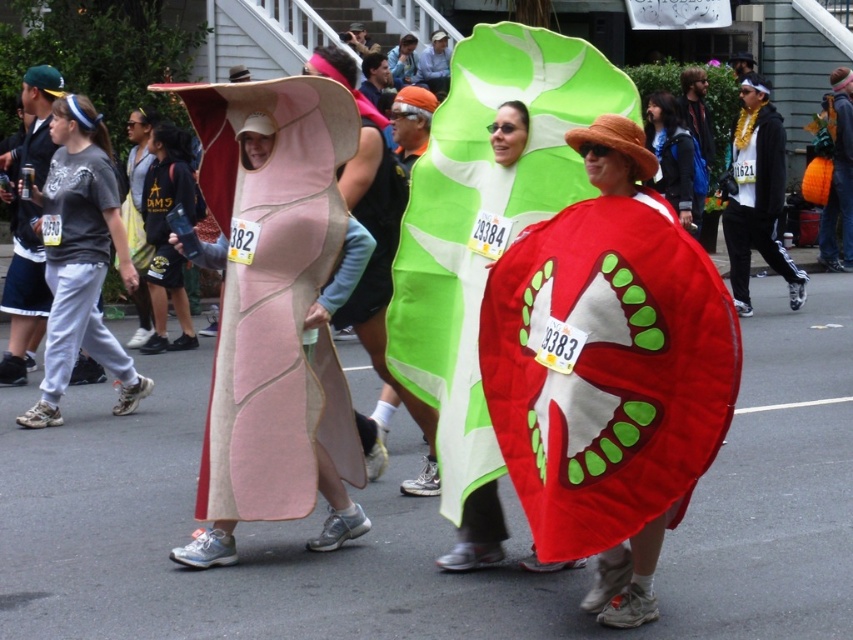
Question: Is velvet red heart at center positioned at the back of gray cotton t-shirt at left?

Choices:
 (A) no
 (B) yes

Answer: (A)

Question: Which point appears farthest from the camera in this image?

Choices:
 (A) (566, 561)
 (B) (624, 312)
 (C) (648, 134)
 (D) (312, 97)

Answer: (C)

Question: Which object appears farthest from the camera in this image?

Choices:
 (A) pink felt/soft fabric at left
 (B) gray cotton t-shirt at left

Answer: (B)

Question: Which point appears farthest from the camera in this image?

Choices:
 (A) (689, 218)
 (B) (64, 195)

Answer: (A)

Question: Does pink felt/soft fabric at left appear over gray cotton t-shirt at left?

Choices:
 (A) yes
 (B) no

Answer: (B)

Question: Can you confirm if velvet red heart at center is wider than pink felt/soft fabric at left?

Choices:
 (A) yes
 (B) no

Answer: (B)